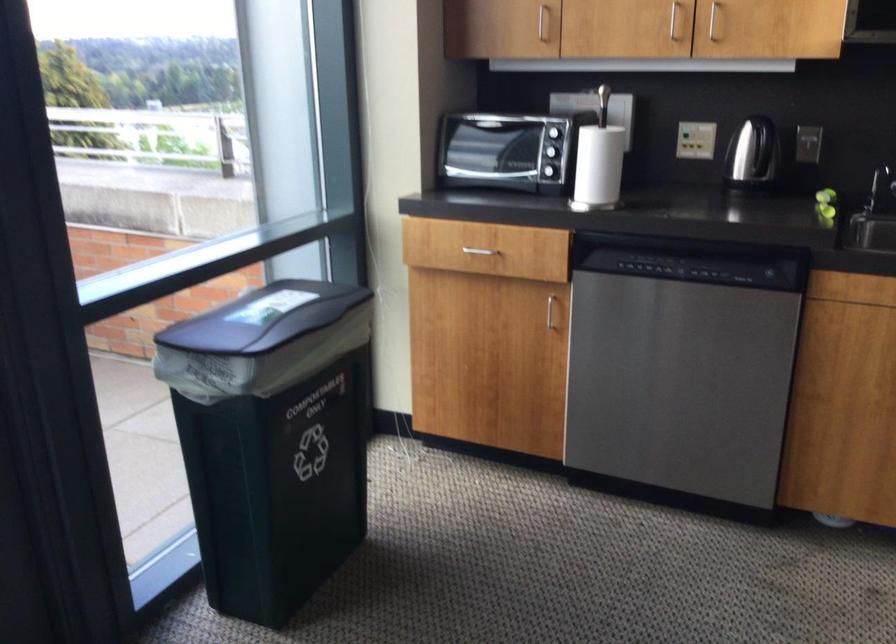
Locate an element on the screen. This screenshot has width=896, height=644. faucet handle is located at coordinates (879, 187).